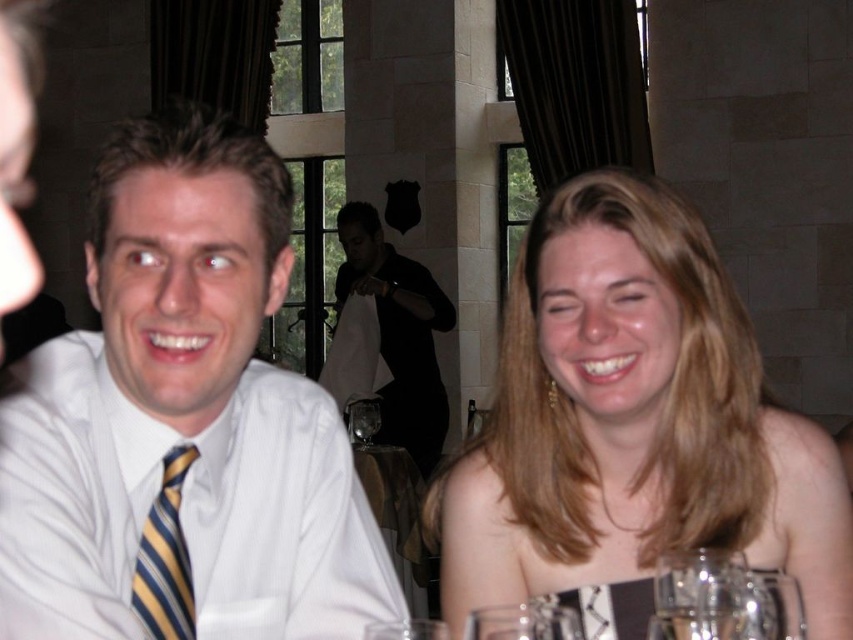
Question: Does white striped tie at left appear over blonde hair at upper right?

Choices:
 (A) yes
 (B) no

Answer: (A)

Question: Is white striped tie at left in front of black matte shirt at center?

Choices:
 (A) no
 (B) yes

Answer: (B)

Question: Does white striped tie at left come in front of black matte shirt at center?

Choices:
 (A) no
 (B) yes

Answer: (B)

Question: Among these objects, which one is nearest to the camera?

Choices:
 (A) transparent glass at center
 (B) yellow striped tie at left
 (C) black matte shirt at center

Answer: (B)

Question: Which point appears farthest from the camera in this image?

Choices:
 (A) (x=281, y=420)
 (B) (x=376, y=243)
 (C) (x=648, y=595)

Answer: (B)

Question: Which point is farther from the camera taking this photo?

Choices:
 (A) (207, 388)
 (B) (167, 490)

Answer: (B)